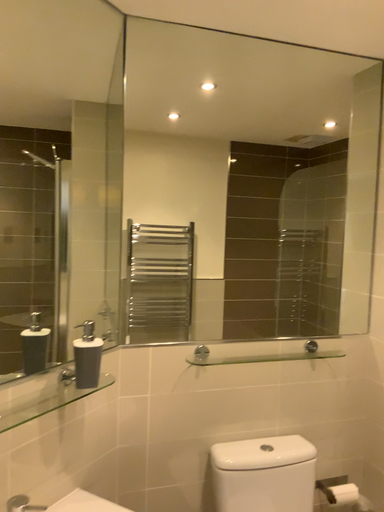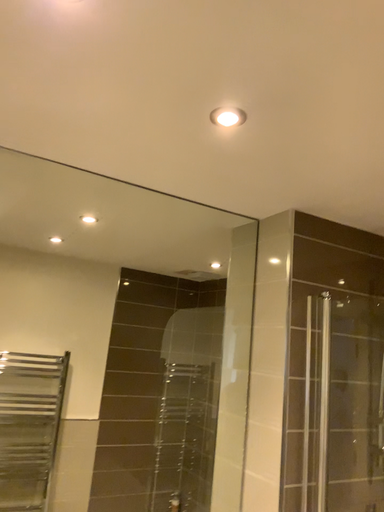
Question: How did the camera likely rotate when shooting the video?

Choices:
 (A) rotated right
 (B) rotated left

Answer: (A)